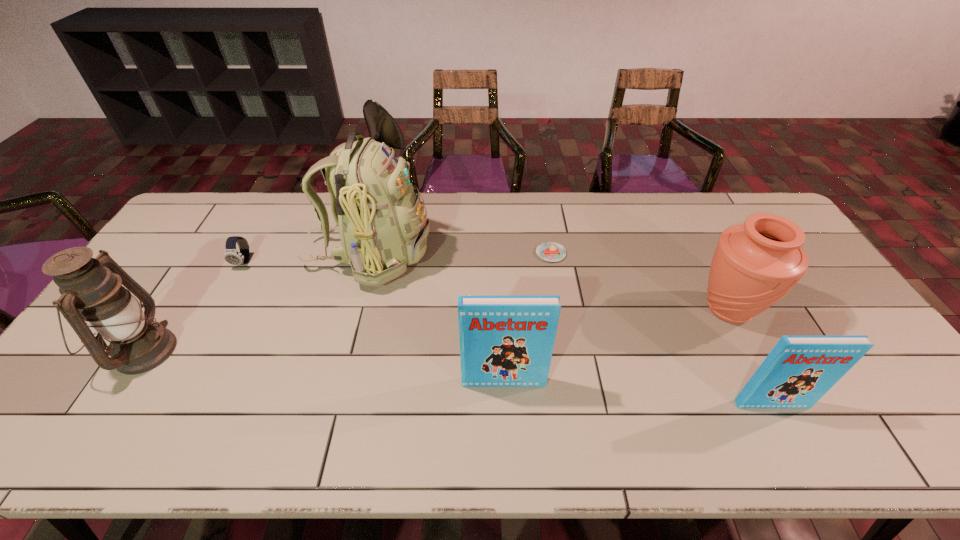
Locate an element on the screen. Image resolution: width=960 pixels, height=540 pixels. free space between the fourth object from right to left and the nearer book is located at coordinates (637, 393).

Locate an element on the screen. This screenshot has height=540, width=960. vacant point located between the leftmost object and the fourth object from right to left is located at coordinates (324, 367).

Locate an element on the screen. Image resolution: width=960 pixels, height=540 pixels. free space between the vase and the shortest object is located at coordinates (639, 281).

Locate an element on the screen. The image size is (960, 540). object that stands as the third closest to the vase is located at coordinates (505, 341).

Select which object is the third closest to the farther book. Please provide its 2D coordinates. Your answer should be formatted as a tuple, i.e. [(x, y)], where the tuple contains the x and y coordinates of a point satisfying the conditions above.

[(799, 370)]

At what (x,y) coordinates should I click in order to perform the action: click on free location that satisfies the following two spatial constraints: 1. on the front-facing side of the backpack; 2. on the right side of the vase. Please return your answer as a coordinate pair (x, y). Image resolution: width=960 pixels, height=540 pixels. Looking at the image, I should click on (355, 309).

Locate an element on the screen. This screenshot has height=540, width=960. vacant area that satisfies the following two spatial constraints: 1. on the front-facing side of the third object from left to right; 2. on the face of the second object from left to right is located at coordinates (368, 262).